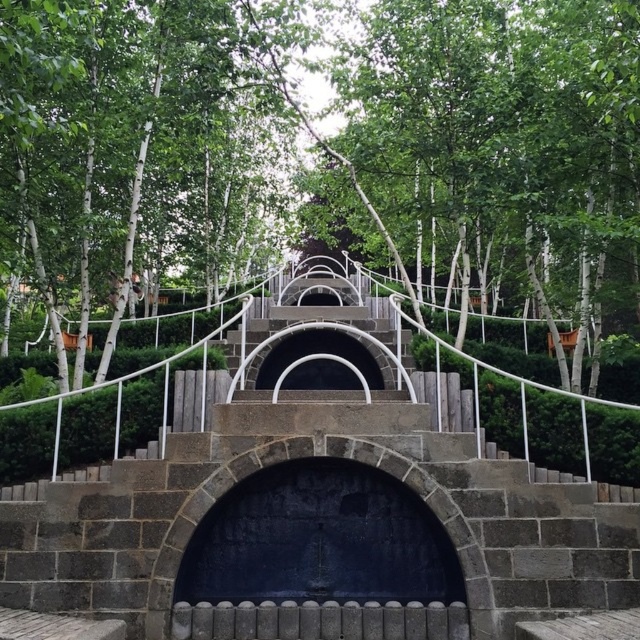
This screenshot has width=640, height=640. I want to click on dark stone archway at center, so click(321, 560).

Does dark stone archway at center appear on the right side of black stone arch at center?

Correct, you'll find dark stone archway at center to the right of black stone arch at center.

Who is more distant from viewer, (444, 544) or (346, 385)?

The point (346, 385) is more distant.

Image resolution: width=640 pixels, height=640 pixels. I want to click on dark stone archway at center, so coord(321,560).

Who is lower down, green leafy tree at center or dark stone archway at center?

dark stone archway at center

Is green leafy tree at center thinner than dark stone archway at center?

Correct, green leafy tree at center's width is less than dark stone archway at center's.

The width and height of the screenshot is (640, 640). What are the coordinates of `green leafy tree at center` in the screenshot? It's located at (340, 141).

Can you confirm if dark gray stone stairs at center is thinner than black stone arch at center?

No.

Which is more to the right, dark gray stone stairs at center or black stone arch at center?

Positioned to the right is dark gray stone stairs at center.

I want to click on dark gray stone stairs at center, so click(317, 516).